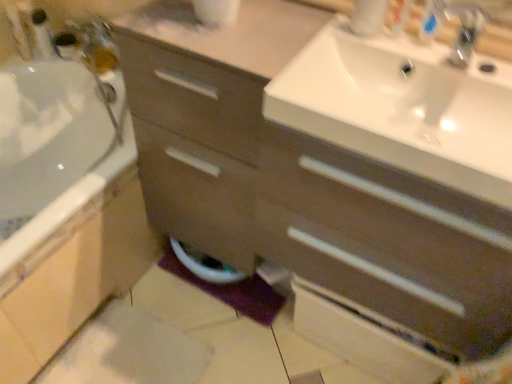
Describe the element at coordinates (399, 105) in the screenshot. The width and height of the screenshot is (512, 384). I see `white glossy sink at upper right` at that location.

The width and height of the screenshot is (512, 384). What do you see at coordinates (466, 32) in the screenshot? I see `metallic silver faucet at upper right` at bounding box center [466, 32].

Find the location of `purple fabric bath mat at lower center`. purple fabric bath mat at lower center is located at coordinates (232, 291).

Image resolution: width=512 pixels, height=384 pixels. I want to click on metallic silver faucet at upper left, acting as the first toiletry starting from the left, so click(42, 35).

I want to click on white glossy sink at upper right, so pos(399,105).

Between point (479, 14) and point (46, 44), which one is positioned in front?

Point (479, 14)

Considering the relative sizes of metallic silver faucet at upper right and metallic silver faucet at upper left, arranged as the first toiletry when viewed from the back, in the image provided, is metallic silver faucet at upper right wider than metallic silver faucet at upper left, arranged as the first toiletry when viewed from the back,?

Yes, metallic silver faucet at upper right is wider than metallic silver faucet at upper left, arranged as the first toiletry when viewed from the back.

From a real-world perspective, between metallic silver faucet at upper right and metallic silver faucet at upper left, which is the second toiletry in bottom-to-top order, who is vertically lower?

metallic silver faucet at upper left, which is the second toiletry in bottom-to-top order.

Looking at this image, is white glossy sink at upper right facing towards metallic silver faucet at upper left, acting as the first toiletry starting from the left?

No, white glossy sink at upper right is not oriented towards metallic silver faucet at upper left, acting as the first toiletry starting from the left.

From the picture: Between white glossy sink at upper right and metallic silver faucet at upper left, arranged as the first toiletry when viewed from the back, which one has less height?

Standing shorter between the two is white glossy sink at upper right.

Is white glossy sink at upper right facing towards metallic silver faucet at upper right?

No, white glossy sink at upper right is not facing towards metallic silver faucet at upper right.

From a real-world perspective, is white glossy sink at upper right under metallic silver faucet at upper right?

Indeed, from a real-world perspective, white glossy sink at upper right is positioned beneath metallic silver faucet at upper right.

How distant is white glossy sink at upper right from metallic silver faucet at upper right?

They are 8.45 inches apart.

Which is more to the right, white plastic toothbrush at upper right, the 1th toiletry positioned from the front, or white glossy toilet bowl at lower center?

white plastic toothbrush at upper right, the 1th toiletry positioned from the front.

Is point (406, 8) positioned in front of point (197, 274)?

Yes, it is.

Is white plastic toothbrush at upper right, which is counted as the 2th toiletry, starting from the top, positioned beyond the bounds of white glossy toilet bowl at lower center?

That's correct, white plastic toothbrush at upper right, which is counted as the 2th toiletry, starting from the top, is outside of white glossy toilet bowl at lower center.

Considering their positions, is metallic silver faucet at upper right located in front of or behind white glossy sink at upper right?

In the image, metallic silver faucet at upper right appears behind white glossy sink at upper right.

Which of these two, metallic silver faucet at upper right or white glossy sink at upper right, stands taller?

Standing taller between the two is white glossy sink at upper right.

Is metallic silver faucet at upper right far away from white glossy sink at upper right?

No, there isn't a large distance between metallic silver faucet at upper right and white glossy sink at upper right.

The image size is (512, 384). What are the coordinates of `sink above the purple fabric bath mat at lower center (from the image's perspective)` in the screenshot? It's located at (399, 105).

From the image's perspective, which one is positioned higher, purple fabric bath mat at lower center or white glossy sink at upper right?

From the image's view, white glossy sink at upper right is above.

Considering the positions of points (207, 291) and (340, 54), is point (207, 291) closer to camera compared to point (340, 54)?

No, (207, 291) is behind (340, 54).

Is purple fabric bath mat at lower center at the right side of white glossy sink at upper right?

No.

From a real-world perspective, between white glossy toilet bowl at lower center and white plastic toothbrush at upper right, the second toiletry when ordered from left to right, who is vertically higher?

From a 3D spatial view, white plastic toothbrush at upper right, the second toiletry when ordered from left to right, is above.

From the image's perspective, is white glossy toilet bowl at lower center on white plastic toothbrush at upper right, arranged as the 1th toiletry when viewed from the right?

Incorrect, from the image's perspective, white glossy toilet bowl at lower center is lower than white plastic toothbrush at upper right, arranged as the 1th toiletry when viewed from the right.

Does point (172, 247) appear closer or farther from the camera than point (394, 18)?

Clearly, point (172, 247) is more distant from the camera than point (394, 18).

Image resolution: width=512 pixels, height=384 pixels. I want to click on toiletry that is the 2nd object located above the metallic silver faucet at upper right (from the image's perspective), so click(42, 35).

Starting from the white glossy sink at upper right, which toiletry is the 2nd one behind? Please provide its 2D coordinates.

[(42, 35)]

From the image, which object appears to be nearer to white glossy sink at upper right, white glossy toilet bowl at lower center or purple fabric bath mat at lower center?

white glossy toilet bowl at lower center is closer to white glossy sink at upper right.

Which object lies nearer to the anchor point purple fabric bath mat at lower center, white glossy sink at upper right or metallic silver faucet at upper left, the 2th toiletry in the right-to-left sequence?

Based on the image, white glossy sink at upper right appears to be nearer to purple fabric bath mat at lower center.

Based on their spatial positions, is white plastic toothbrush at upper right, the 1th toiletry positioned from the front, or metallic silver faucet at upper left, arranged as the 1th toiletry when viewed from the top, further from white glossy toilet bowl at lower center?

Among the two, metallic silver faucet at upper left, arranged as the 1th toiletry when viewed from the top, is located further to white glossy toilet bowl at lower center.

Consider the image. Considering their positions, is white plastic toothbrush at upper right, which is the 1th toiletry in bottom-to-top order, positioned further to metallic silver faucet at upper left, which ranks as the 2th toiletry in front-to-back order, than purple fabric bath mat at lower center?

white plastic toothbrush at upper right, which is the 1th toiletry in bottom-to-top order.

When comparing their distances from white glossy toilet bowl at lower center, does white glossy sink at upper right or metallic silver faucet at upper right seem further?

Among the two, metallic silver faucet at upper right is located further to white glossy toilet bowl at lower center.

Which object lies further to the anchor point white plastic toothbrush at upper right, arranged as the 1th toiletry when viewed from the right, purple fabric bath mat at lower center or white glossy sink at upper right?

purple fabric bath mat at lower center.

Looking at the image, which one is located further to metallic silver faucet at upper left, arranged as the 1th toiletry when viewed from the top, white glossy toilet bowl at lower center or white glossy sink at upper right?

white glossy sink at upper right is positioned further to the anchor metallic silver faucet at upper left, arranged as the 1th toiletry when viewed from the top.

Estimate the real-world distances between objects in this image. Which object is closer to white glossy toilet bowl at lower center, white glossy sink at upper right or metallic silver faucet at upper left, arranged as the 1th toiletry when viewed from the top?

Based on the image, white glossy sink at upper right appears to be nearer to white glossy toilet bowl at lower center.

This screenshot has width=512, height=384. In order to click on bath mat situated between metallic silver faucet at upper left, arranged as the 1th toiletry when viewed from the top, and white plastic toothbrush at upper right, arranged as the 1th toiletry when viewed from the right, from left to right in this screenshot , I will do `click(232, 291)`.

Locate an element on the screen. bath mat between metallic silver faucet at upper left, arranged as the first toiletry when viewed from the back, and metallic silver faucet at upper right, in the horizontal direction is located at coordinates tap(232, 291).

Where is `toilet bowl between white plastic toothbrush at upper right, which is counted as the 2th toiletry, starting from the top, and purple fabric bath mat at lower center vertically`? The width and height of the screenshot is (512, 384). toilet bowl between white plastic toothbrush at upper right, which is counted as the 2th toiletry, starting from the top, and purple fabric bath mat at lower center vertically is located at coordinates (205, 265).

Where is `tap between white glossy sink at upper right and white glossy toilet bowl at lower center in the front-back direction`? tap between white glossy sink at upper right and white glossy toilet bowl at lower center in the front-back direction is located at coordinates (466, 32).